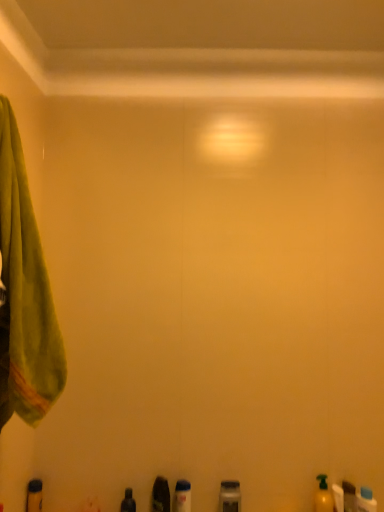
Question: From the image's perspective, is translucent plastic bottle at lower center, which is the third toiletry from left to right, below yellow matte bottle at lower right, the 4th toiletry when ordered from right to left?

Choices:
 (A) yes
 (B) no

Answer: (A)

Question: Considering the relative sizes of translucent plastic bottle at lower center, which is the third toiletry from left to right, and yellow matte bottle at lower right, the 4th toiletry when ordered from right to left, in the image provided, is translucent plastic bottle at lower center, which is the third toiletry from left to right, shorter than yellow matte bottle at lower right, the 4th toiletry when ordered from right to left,?

Choices:
 (A) no
 (B) yes

Answer: (B)

Question: Is translucent plastic bottle at lower center, which is the third toiletry from left to right, not within yellow matte bottle at lower right, the fifth toiletry in the left-to-right sequence?

Choices:
 (A) no
 (B) yes

Answer: (B)

Question: From a real-world perspective, is translucent plastic bottle at lower center, which is the sixth toiletry from right to left, over yellow matte bottle at lower right, the fifth toiletry in the left-to-right sequence?

Choices:
 (A) no
 (B) yes

Answer: (A)

Question: Considering the relative positions of translucent plastic bottle at lower center, which is the sixth toiletry from right to left, and yellow matte bottle at lower right, the fifth toiletry in the left-to-right sequence, in the image provided, is translucent plastic bottle at lower center, which is the sixth toiletry from right to left, in front of yellow matte bottle at lower right, the fifth toiletry in the left-to-right sequence,?

Choices:
 (A) no
 (B) yes

Answer: (A)

Question: Considering the relative positions of metallic gray container at lower center, arranged as the fourth toiletry when viewed from the left, and yellow matte bottle at lower right, the 4th toiletry when ordered from right to left, in the image provided, is metallic gray container at lower center, arranged as the fourth toiletry when viewed from the left, to the left or to the right of yellow matte bottle at lower right, the 4th toiletry when ordered from right to left,?

Choices:
 (A) right
 (B) left

Answer: (B)

Question: In terms of size, does metallic gray container at lower center, arranged as the fourth toiletry when viewed from the left, appear bigger or smaller than yellow matte bottle at lower right, the 4th toiletry when ordered from right to left?

Choices:
 (A) small
 (B) big

Answer: (B)

Question: Is metallic gray container at lower center, the 5th toiletry in the right-to-left sequence, wider or thinner than yellow matte bottle at lower right, the 4th toiletry when ordered from right to left?

Choices:
 (A) thin
 (B) wide

Answer: (A)

Question: Relative to yellow matte bottle at lower right, the fifth toiletry in the left-to-right sequence, is metallic gray container at lower center, arranged as the fourth toiletry when viewed from the left, in front or behind?

Choices:
 (A) front
 (B) behind

Answer: (B)

Question: In the image, is translucent plastic bottle at lower right, which is the second toiletry from right to left, on the left side or the right side of metallic gray container at lower center, arranged as the fourth toiletry when viewed from the left?

Choices:
 (A) left
 (B) right

Answer: (B)

Question: From the image's perspective, is translucent plastic bottle at lower right, which is the second toiletry from right to left, above or below metallic gray container at lower center, arranged as the fourth toiletry when viewed from the left?

Choices:
 (A) above
 (B) below

Answer: (B)

Question: Do you think translucent plastic bottle at lower right, arranged as the 7th toiletry when viewed from the left, is within metallic gray container at lower center, the 5th toiletry in the right-to-left sequence, or outside of it?

Choices:
 (A) outside
 (B) inside

Answer: (A)

Question: Is translucent plastic bottle at lower right, which is the second toiletry from right to left, taller or shorter than metallic gray container at lower center, the 5th toiletry in the right-to-left sequence?

Choices:
 (A) short
 (B) tall

Answer: (B)

Question: Looking at their shapes, would you say shiny black bottle at lower center, the 7th toiletry when ordered from right to left, is wider or thinner than metallic gray container at lower center, arranged as the fourth toiletry when viewed from the left?

Choices:
 (A) thin
 (B) wide

Answer: (A)

Question: Considering the positions of shiny black bottle at lower center, the 7th toiletry when ordered from right to left, and metallic gray container at lower center, arranged as the fourth toiletry when viewed from the left, in the image, is shiny black bottle at lower center, the 7th toiletry when ordered from right to left, taller or shorter than metallic gray container at lower center, arranged as the fourth toiletry when viewed from the left,?

Choices:
 (A) short
 (B) tall

Answer: (A)